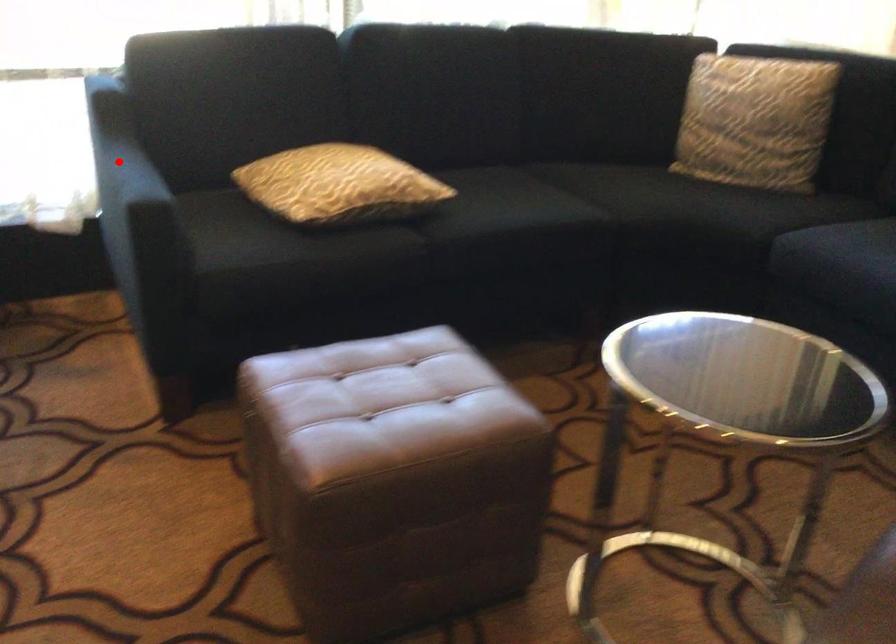
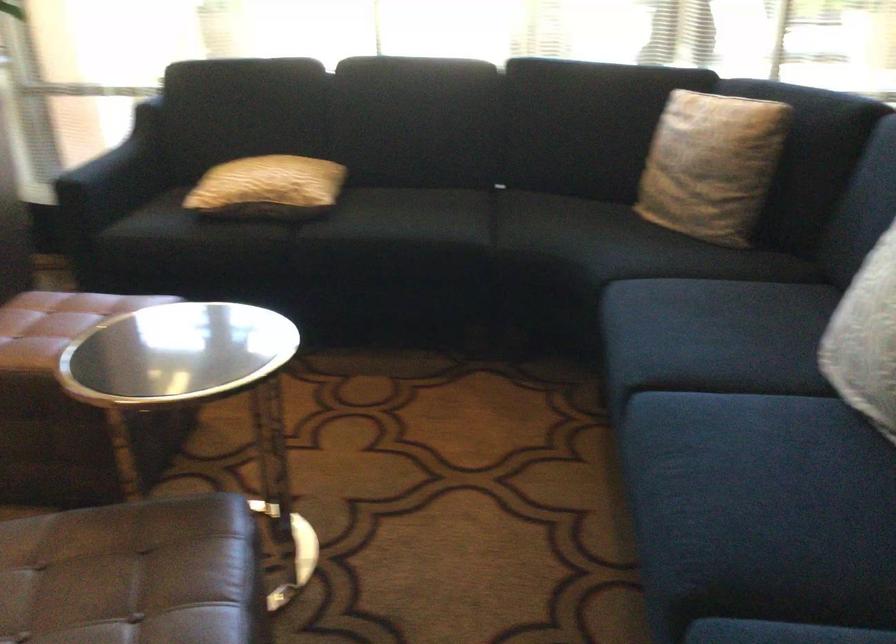
Question: I am providing you with two images of the same scene from different viewpoints. Image1 has a red point marked. In image2, the corresponding 3D location appears at what relative position? Reply with the corresponding letter.

Choices:
 (A) Closer
 (B) Farther

Answer: (B)